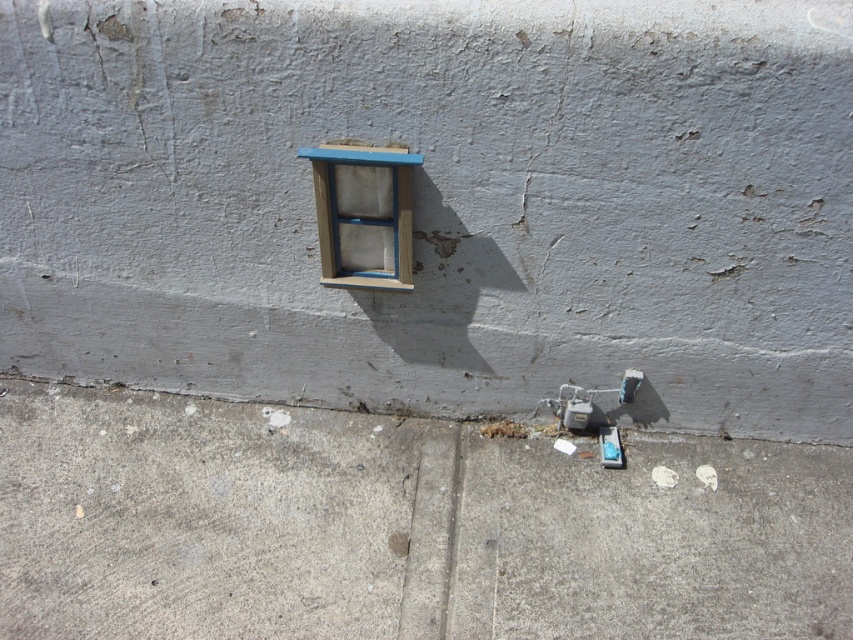
Does smooth concrete at lower center have a lesser width compared to wooden frame at center?

No, smooth concrete at lower center is not thinner than wooden frame at center.

Is smooth concrete at lower center to the left of wooden frame at center from the viewer's perspective?

Indeed, smooth concrete at lower center is positioned on the left side of wooden frame at center.

Is point (274, 36) in front of point (318, 184)?

Yes, it is in front of point (318, 184).

Locate an element on the screen. This screenshot has width=853, height=640. smooth concrete at lower center is located at coordinates 438,202.

Is smooth concrete at lower center to the right of gray concrete sidewalk at lower center from the viewer's perspective?

In fact, smooth concrete at lower center is to the left of gray concrete sidewalk at lower center.

This screenshot has width=853, height=640. What do you see at coordinates (438, 202) in the screenshot?
I see `smooth concrete at lower center` at bounding box center [438, 202].

Where is `smooth concrete at lower center`? This screenshot has height=640, width=853. smooth concrete at lower center is located at coordinates click(438, 202).

In order to click on smooth concrete at lower center in this screenshot , I will do `click(438, 202)`.

Between gray concrete sidewalk at lower center and wooden frame at center, which one has more height?

gray concrete sidewalk at lower center is taller.

Consider the image. Does gray concrete sidewalk at lower center have a larger size compared to wooden frame at center?

Yes.

What are the coordinates of `gray concrete sidewalk at lower center` in the screenshot? It's located at (399, 528).

Where is `gray concrete sidewalk at lower center`? The width and height of the screenshot is (853, 640). gray concrete sidewalk at lower center is located at coordinates (399, 528).